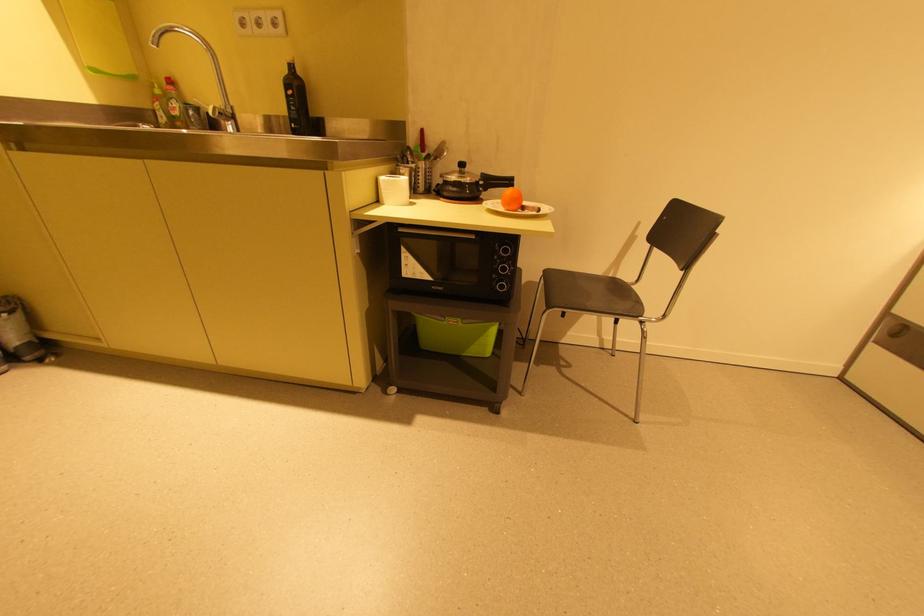
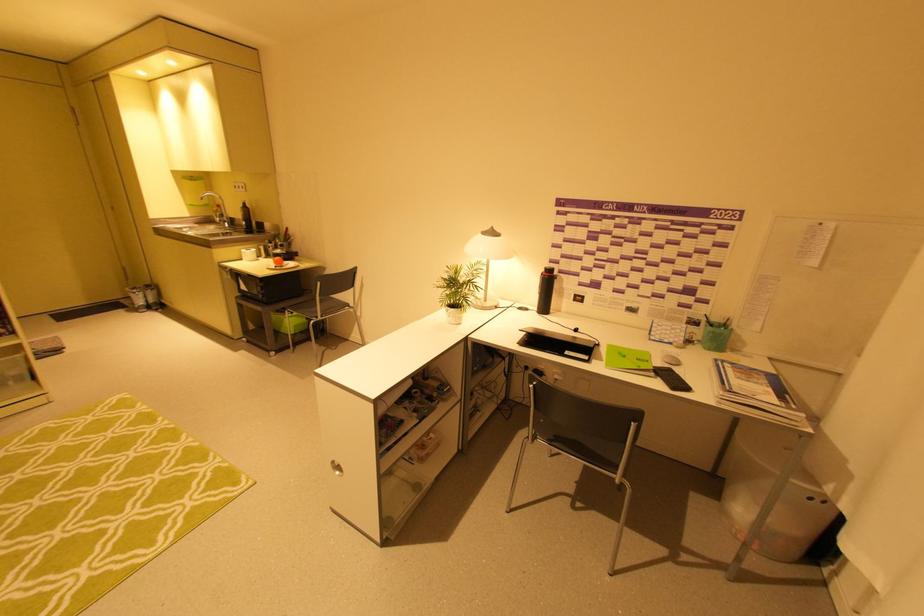
The point at (152, 106) is marked in the first image. Where is the corresponding point in the second image?

(215, 215)